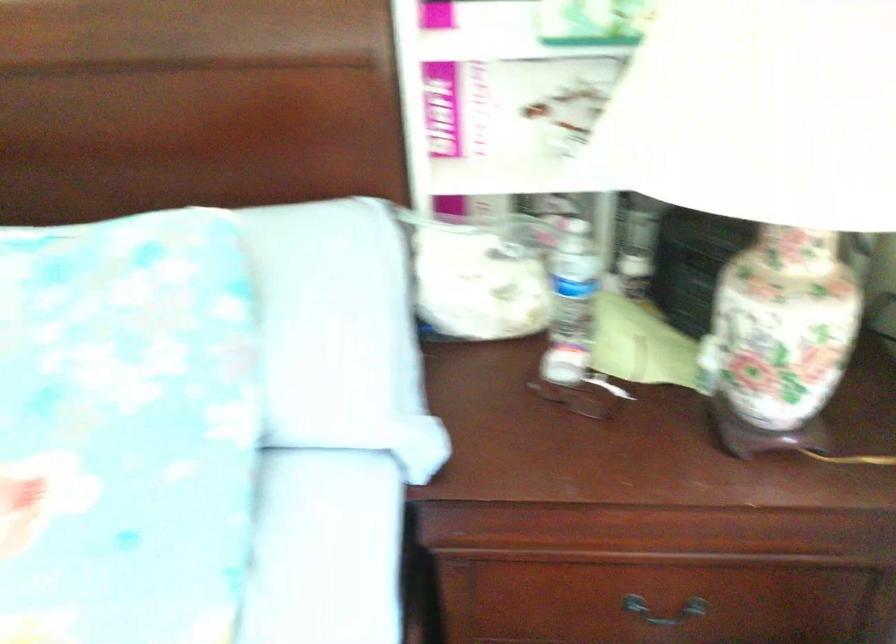
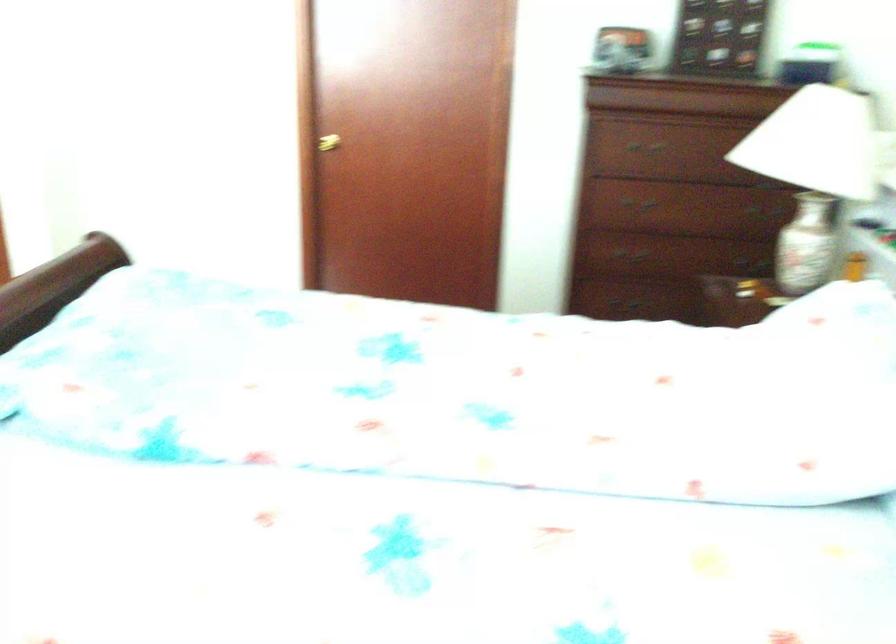
How did the camera likely rotate?

The camera rotated toward left-down.